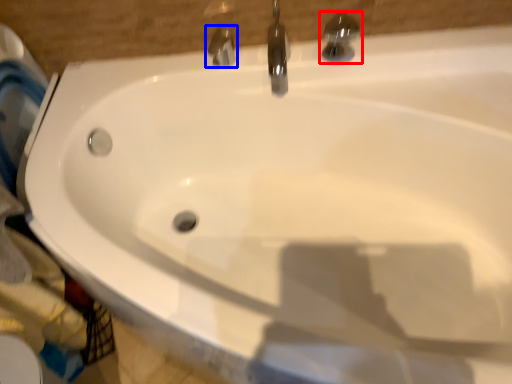
Question: Which of the following is the closest to the observer, tap (highlighted by a red box) or tap (highlighted by a blue box)?

Choices:
 (A) tap
 (B) tap

Answer: (A)